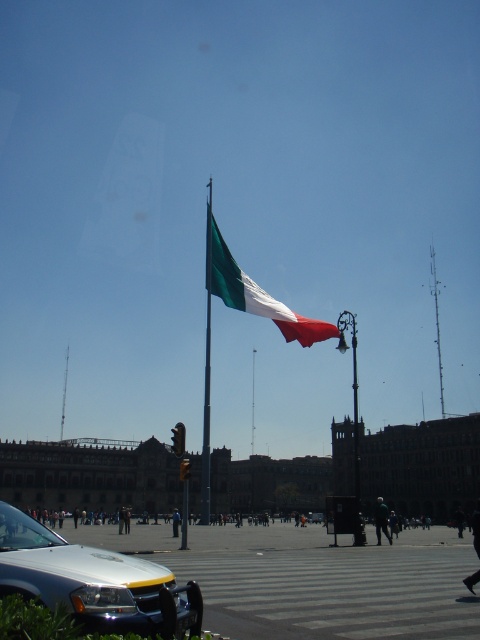
Question: Which object is farther from the camera taking this photo?

Choices:
 (A) metallic silver mast at upper right
 (B) metallic flag pole at center
 (C) green matte flag at center
 (D) silver metallic car at lower left

Answer: (A)

Question: Does silver metallic car at lower left appear on the left side of metallic flag pole at center?

Choices:
 (A) yes
 (B) no

Answer: (A)

Question: Which object appears closest to the camera in this image?

Choices:
 (A) metallic silver mast at upper right
 (B) metallic flag pole at center
 (C) silver metallic car at lower left
 (D) metallic tower at upper center

Answer: (C)

Question: Can you confirm if green matte flag at center is positioned to the left of metallic silver mast at upper right?

Choices:
 (A) yes
 (B) no

Answer: (A)

Question: Which point appears farthest from the camera in this image?

Choices:
 (A) pyautogui.click(x=207, y=252)
 (B) pyautogui.click(x=66, y=380)
 (C) pyautogui.click(x=296, y=317)
 (D) pyautogui.click(x=10, y=593)

Answer: (B)

Question: Observing the image, what is the correct spatial positioning of metallic flag pole at center in reference to metallic tower at upper center?

Choices:
 (A) above
 (B) below

Answer: (A)